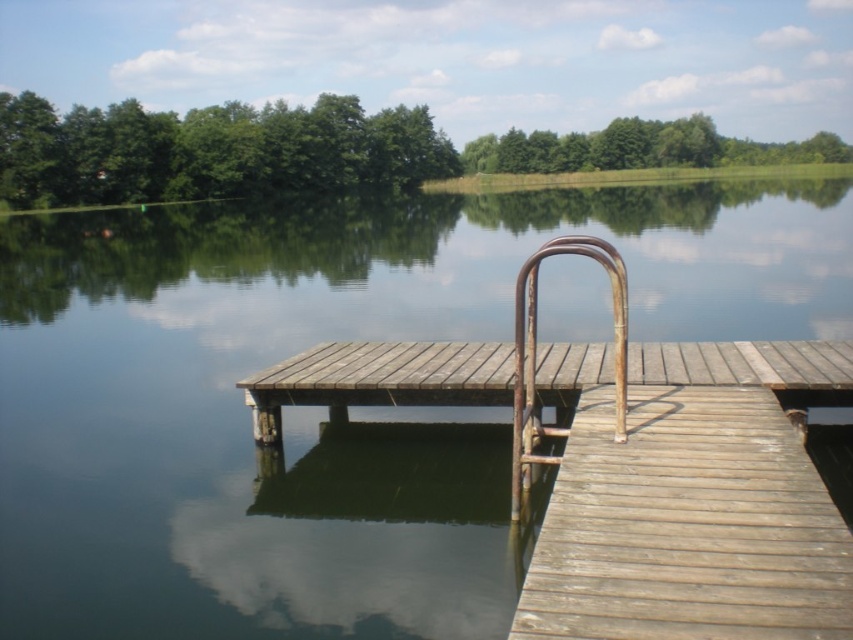
You are standing on the wooden dock and want to reach the water to dip your feet in. Which object must you pass under to get to the water? The weathered wood dock at center or the rusty metal rail at center?

The weathered wood dock at center is positioned under the rusty metal rail at center. To reach the water, you must pass under the rusty metal rail at center.

You are standing on the wooden dock and looking towards the water. There are two points marked on the dock. The first point is at coordinate point (733, 253) and the second point is at coordinate point (318, 369). From your perspective, which point is closer to you?

Point (318, 369) is closer to you because point (733, 253) is behind it.

You are standing on the wooden dock and want to reach the rusty metal rail at center. Which direction should you move to get there from the weathered wood dock at center?

The weathered wood dock at center is to the right of the rusty metal rail at center, so you should move to your left to reach the rusty metal rail at center from the weathered wood dock at center.